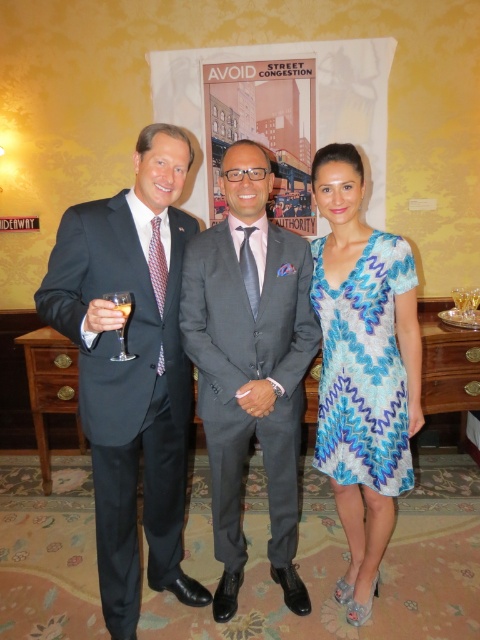
You are standing in the room and want to find the blue lace dress at center. According to the coordinates provided, where should you look?

The blue lace dress at center is located at the coordinates point (363, 369).

You are a photographer trying to adjust the composition of the group photo. The two men in the matte black suit at left and gray suit at center are positioned such that their suits differ in width. Which man should move closer to the camera to ensure both suits appear equally wide in the final photo?

The matte black suit at left is wider than the gray suit at center. To make them appear equally wide in the photo, the matte black suit at left should move closer to the camera since its current width is larger and moving closer would reduce its apparent size in the frame.